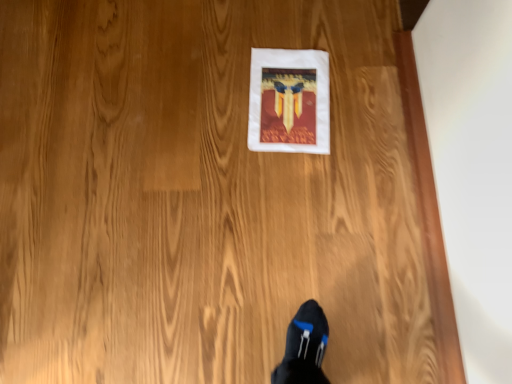
The image size is (512, 384). What are the coordinates of `vacant space to the right of matte paper comic book at center` in the screenshot? It's located at (377, 107).